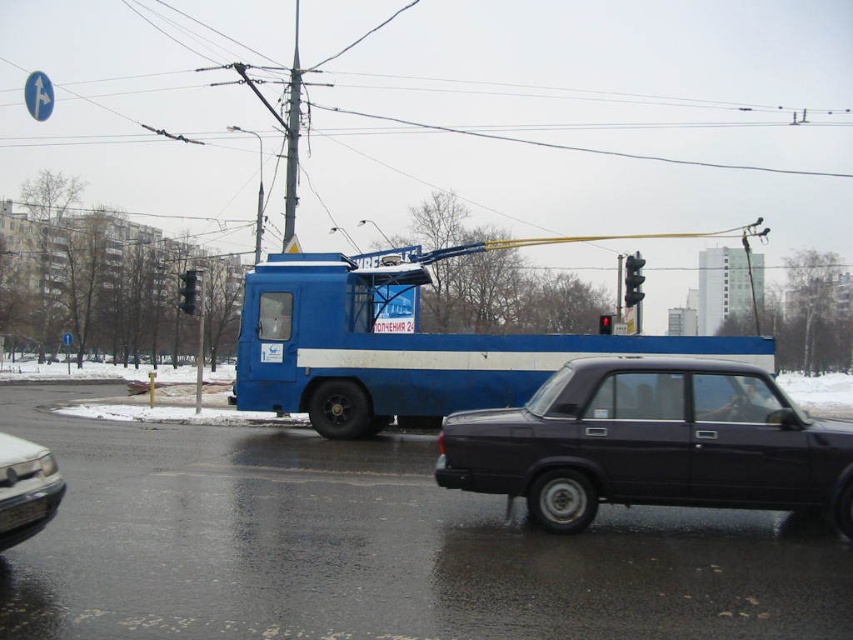
You are a delivery driver who needs to park your 2.5m wide truck in this area. You see the shiny silver car at lower left and the black glass traffic light at upper center. Can you determine if there is enough space between them to park your truck?

The shiny silver car at lower left is narrower than the black glass traffic light at upper center. Since your truck is 2.5m wide, you need to compare the available space between these objects. However, the exact distance between them isn not provided. You should check the actual space on site before deciding.

You are a pedestrian standing at the point marked by coordinates point (187, 291). Looking around, you see a black glass traffic light at upper center. Which direction should you look to see the blue utility vehicle dominating the center of the image?

The blue utility vehicle dominating the center of the image is located below the black glass traffic light at upper center, so you should look downward from the traffic light to find it.